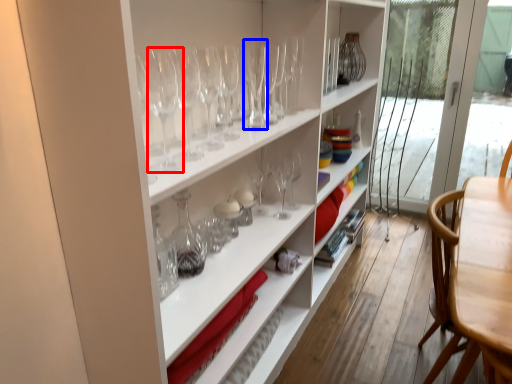
Question: Which object is further to the camera taking this photo, wine glass (highlighted by a red box) or wine glass (highlighted by a blue box)?

Choices:
 (A) wine glass
 (B) wine glass

Answer: (B)